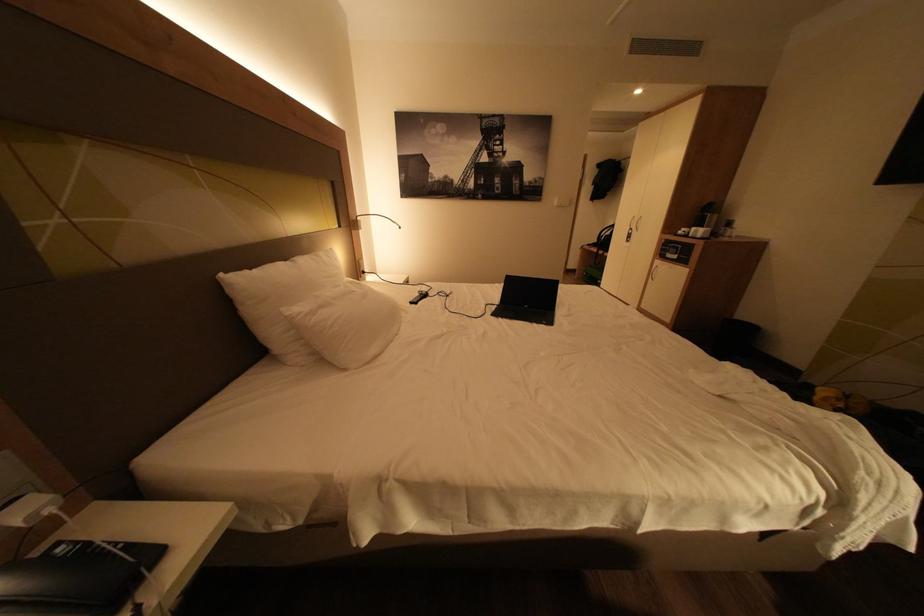
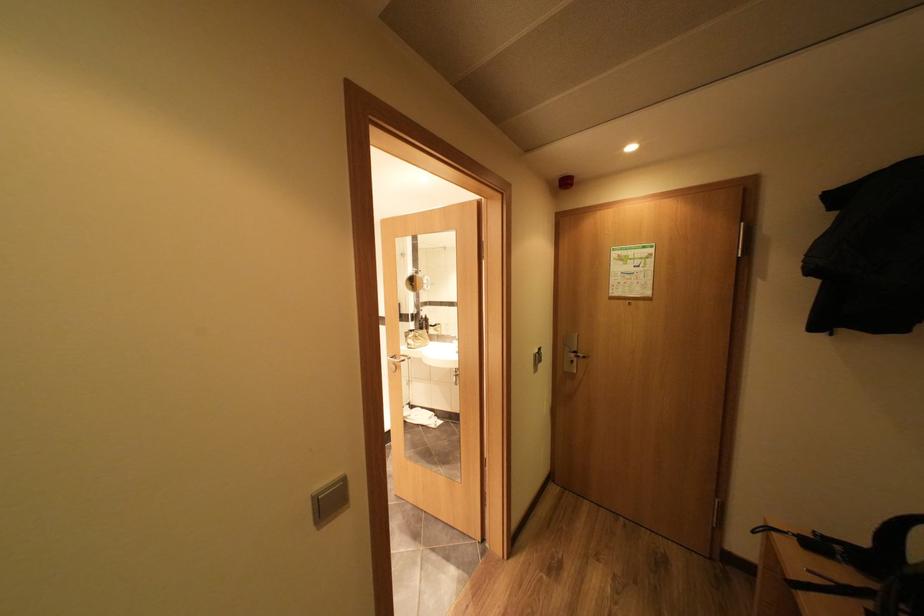
The point at (593, 246) is marked in the first image. Where is the corresponding point in the second image?

(779, 529)